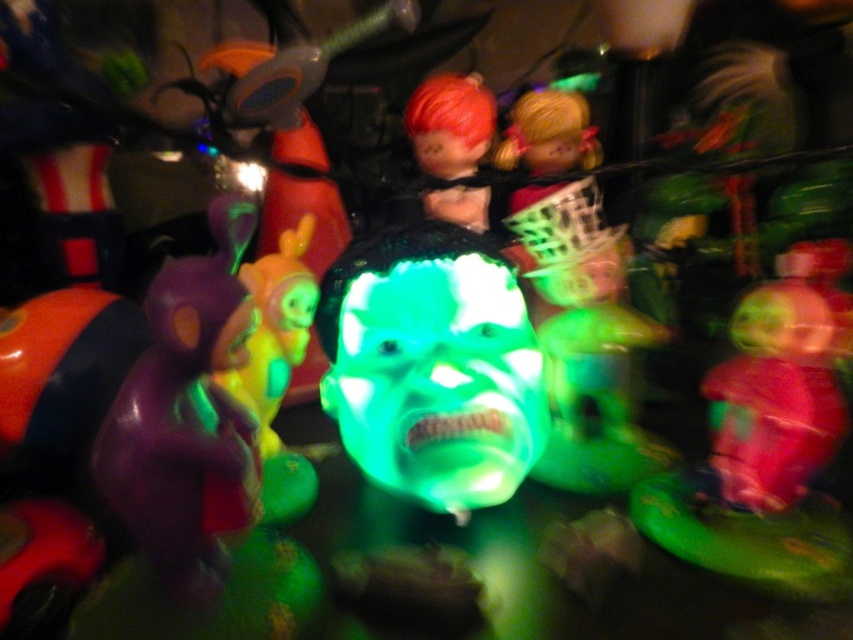
You are a collector who wants to display the green translucent mask at center on a shelf that can only hold items within 25 inches from the viewer. Will the mask fit on this shelf?

The green translucent mask at center is 27.27 inches away from the viewer, which exceeds the shelf limit of 25 inches. Therefore, it won

You are holding a measuring tape and need to determine if a 70 cm long ribbon can reach from your current position to the point at coordinates point (502, 470). Can the ribbon reach that point?

The distance between you and point (502, 470) is 73.68 centimeters. Since the ribbon is only 70 cm long, it cannot reach the point.

You are a collector organizing a display of toys. You need to place a new figurine at point (432, 365). What object is already there?

The green translucent mask at center is located at point (432, 365).